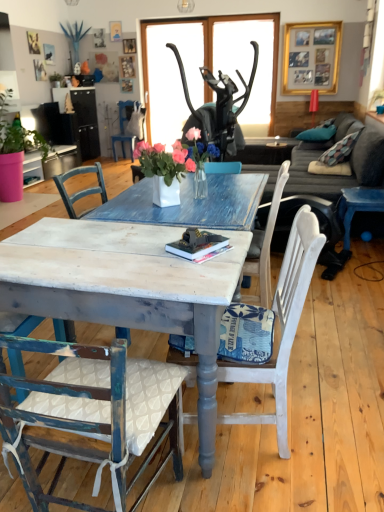
Question: From the image's perspective, is distressed wood table at center on top of gray fabric couch at center?

Choices:
 (A) yes
 (B) no

Answer: (B)

Question: Is distressed wood table at center wider than gray fabric couch at center?

Choices:
 (A) no
 (B) yes

Answer: (A)

Question: Is distressed wood table at center located outside gray fabric couch at center?

Choices:
 (A) no
 (B) yes

Answer: (B)

Question: Is distressed wood table at center at the right side of gray fabric couch at center?

Choices:
 (A) no
 (B) yes

Answer: (A)

Question: Is distressed wood table at center facing towards gray fabric couch at center?

Choices:
 (A) no
 (B) yes

Answer: (A)

Question: Does distressed wood table at center appear on the left side of gray fabric couch at center?

Choices:
 (A) yes
 (B) no

Answer: (A)

Question: Is pink matte pot at left positioned beyond the bounds of white fabric chair at center, which appears as the third chair when viewed from the front?

Choices:
 (A) no
 (B) yes

Answer: (B)

Question: Does pink matte pot at left have a smaller size compared to white fabric chair at center, the 4th chair in the left-to-right sequence?

Choices:
 (A) yes
 (B) no

Answer: (B)

Question: Is pink matte pot at left at the right side of white fabric chair at center, the third chair when ordered from bottom to top?

Choices:
 (A) no
 (B) yes

Answer: (A)

Question: Is pink matte pot at left next to white fabric chair at center, the second chair when ordered from back to front?

Choices:
 (A) yes
 (B) no

Answer: (B)

Question: Does pink matte pot at left have a greater height compared to white fabric chair at center, the third chair when ordered from bottom to top?

Choices:
 (A) yes
 (B) no

Answer: (A)

Question: From a real-world perspective, is pink matte pot at left below white fabric chair at center, the 4th chair in the left-to-right sequence?

Choices:
 (A) no
 (B) yes

Answer: (A)

Question: Is teal fabric pillow at upper right at the right side of gold metallic picture frame at upper center?

Choices:
 (A) yes
 (B) no

Answer: (B)